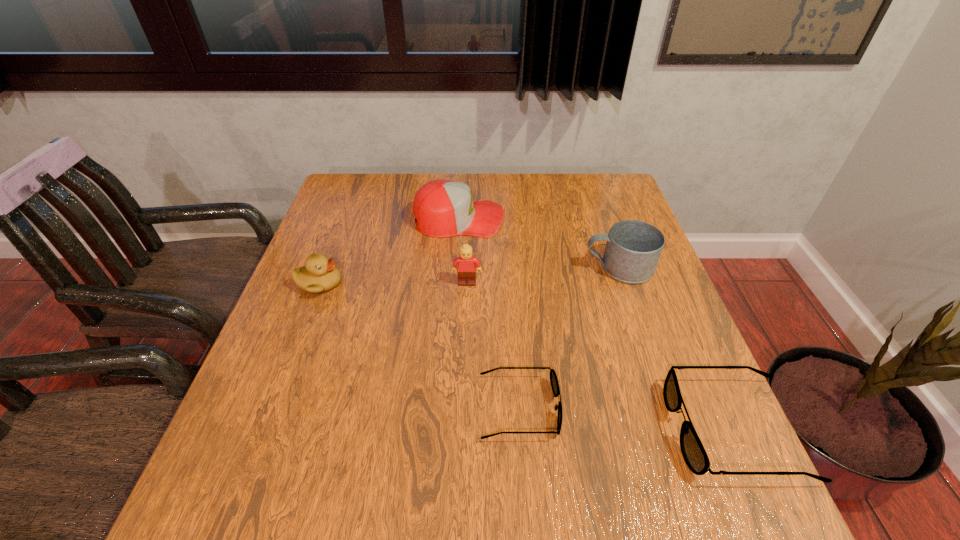
Where is `vacant place for an extra spectacles on the left`? The height and width of the screenshot is (540, 960). vacant place for an extra spectacles on the left is located at coordinates (321, 388).